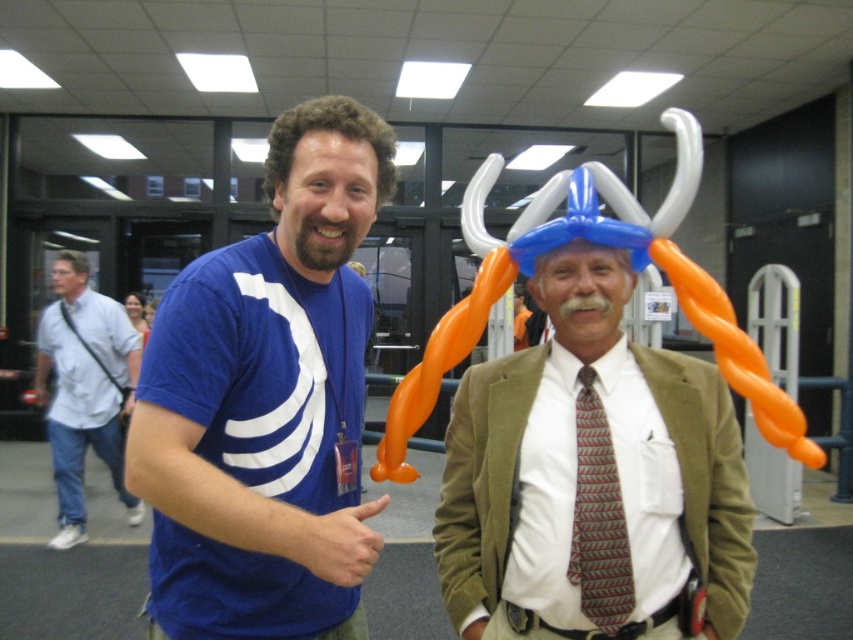
Question: Which point is farther from the camera taking this photo?

Choices:
 (A) (596, 554)
 (B) (64, 259)
 (C) (511, 516)

Answer: (B)

Question: Among these points, which one is farthest from the camera?

Choices:
 (A) (178, 586)
 (B) (582, 538)
 (C) (108, 349)

Answer: (C)

Question: Is light blue shirt at left in front of striped fabric tie at center?

Choices:
 (A) yes
 (B) no

Answer: (B)

Question: Estimate the real-world distances between objects in this image. Which object is farther from the blue matte t-shirt at center?

Choices:
 (A) matte orange balloon horns at center
 (B) striped fabric tie at center
 (C) light blue shirt at left

Answer: (C)

Question: Where is light blue shirt at left located in relation to striped fabric tie at center in the image?

Choices:
 (A) left
 (B) right

Answer: (A)

Question: Is matte orange balloon horns at center bigger than striped fabric tie at center?

Choices:
 (A) no
 (B) yes

Answer: (B)